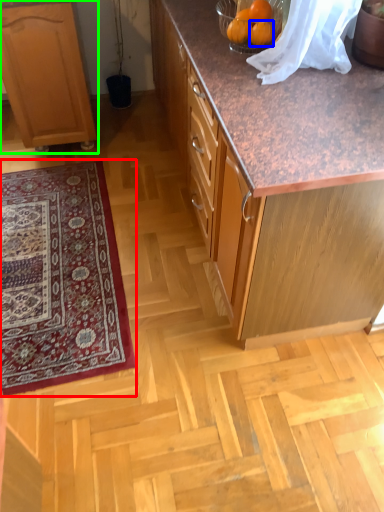
Question: Considering the real-world distances, which object is closest to mat (highlighted by a red box)? orange (highlighted by a blue box) or cabinetry (highlighted by a green box).

Choices:
 (A) orange
 (B) cabinetry

Answer: (B)